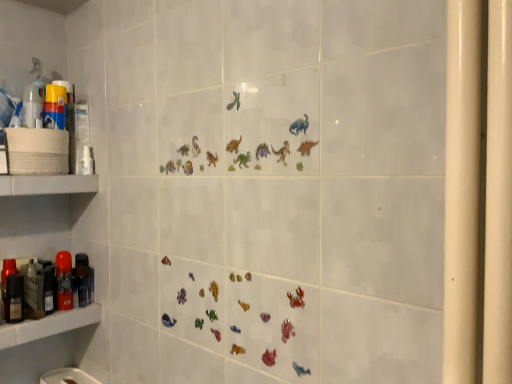
Question: From a real-world perspective, does metallic black hairdryer at left, positioned as the first toiletry in right-to-left order, sit lower than translucent plastic spray bottle at left?

Choices:
 (A) yes
 (B) no

Answer: (A)

Question: Can you confirm if metallic black hairdryer at left, positioned as the first toiletry in back-to-front order, is smaller than translucent plastic spray bottle at left?

Choices:
 (A) no
 (B) yes

Answer: (A)

Question: Does metallic black hairdryer at left, which is the third toiletry from left to right, turn towards translucent plastic spray bottle at left?

Choices:
 (A) yes
 (B) no

Answer: (B)

Question: Considering the relative positions of metallic black hairdryer at left, positioned as the first toiletry in right-to-left order, and translucent plastic spray bottle at left in the image provided, is metallic black hairdryer at left, positioned as the first toiletry in right-to-left order, behind translucent plastic spray bottle at left?

Choices:
 (A) yes
 (B) no

Answer: (A)

Question: Can you confirm if metallic black hairdryer at left, the third toiletry from the front, is taller than translucent plastic spray bottle at left?

Choices:
 (A) no
 (B) yes

Answer: (B)

Question: Is matte plastic shelf at lower left, which is the 2th shelf in top-to-bottom order, wider or thinner than metallic black hairdryer at left, which is the third toiletry from left to right?

Choices:
 (A) wide
 (B) thin

Answer: (A)

Question: From a real-world perspective, is matte plastic shelf at lower left, the 1th shelf in the bottom-to-top sequence, physically located above or below metallic black hairdryer at left, positioned as the first toiletry in right-to-left order?

Choices:
 (A) below
 (B) above

Answer: (A)

Question: Is matte plastic shelf at lower left, the 1th shelf in the bottom-to-top sequence, in front of or behind metallic black hairdryer at left, positioned as the first toiletry in back-to-front order, in the image?

Choices:
 (A) front
 (B) behind

Answer: (A)

Question: From the image's perspective, is matte plastic shelf at lower left, the 1th shelf in the bottom-to-top sequence, positioned above or below metallic black hairdryer at left, positioned as the first toiletry in back-to-front order?

Choices:
 (A) above
 (B) below

Answer: (B)

Question: Considering the relative positions of matte red spray can at left, which appears as the 2th toiletry when viewed from the front, and matte plastic shelf at lower left, which is the 2th shelf in top-to-bottom order, in the image provided, is matte red spray can at left, which appears as the 2th toiletry when viewed from the front, to the left or to the right of matte plastic shelf at lower left, which is the 2th shelf in top-to-bottom order,?

Choices:
 (A) right
 (B) left

Answer: (A)

Question: Considering their positions, is matte red spray can at left, the 2th toiletry from the left, located in front of or behind matte plastic shelf at lower left, the 1th shelf in the bottom-to-top sequence?

Choices:
 (A) front
 (B) behind

Answer: (B)

Question: Would you say matte red spray can at left, arranged as the 2th toiletry when viewed from the right, is inside or outside matte plastic shelf at lower left, which is the 2th shelf in top-to-bottom order?

Choices:
 (A) outside
 (B) inside

Answer: (A)

Question: From a real-world perspective, relative to matte plastic shelf at lower left, the 1th shelf in the bottom-to-top sequence, is matte red spray can at left, arranged as the 2th toiletry when viewed from the right, vertically above or below?

Choices:
 (A) below
 (B) above

Answer: (B)

Question: Considering the positions of white matte shelf at left, the 1th shelf when ordered from top to bottom, and metallic black hairdryer at left, the third toiletry from the front, in the image, is white matte shelf at left, the 1th shelf when ordered from top to bottom, taller or shorter than metallic black hairdryer at left, the third toiletry from the front,?

Choices:
 (A) short
 (B) tall

Answer: (A)

Question: In terms of width, does white matte shelf at left, the 1th shelf when ordered from top to bottom, look wider or thinner when compared to metallic black hairdryer at left, positioned as the first toiletry in right-to-left order?

Choices:
 (A) thin
 (B) wide

Answer: (B)